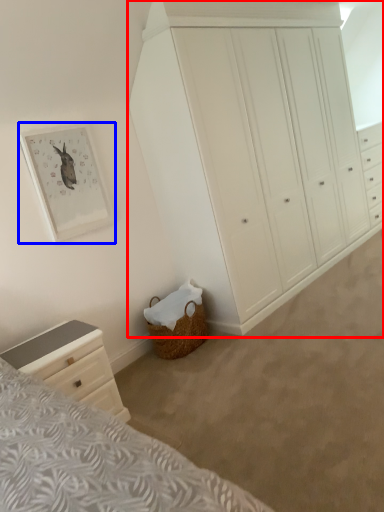
Question: Which object appears farthest to the camera in this image, chest of drawers (highlighted by a red box) or picture frame (highlighted by a blue box)?

Choices:
 (A) chest of drawers
 (B) picture frame

Answer: (B)